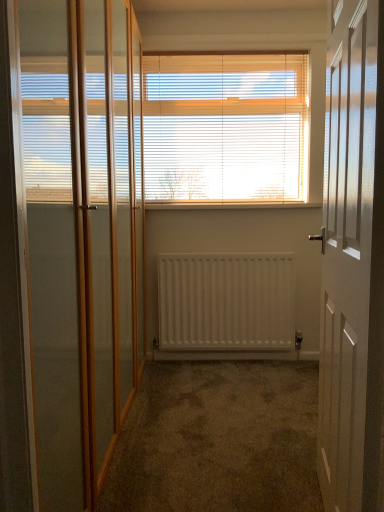
I want to click on vacant space underneath white wood blinds at center (from a real-world perspective), so click(x=233, y=204).